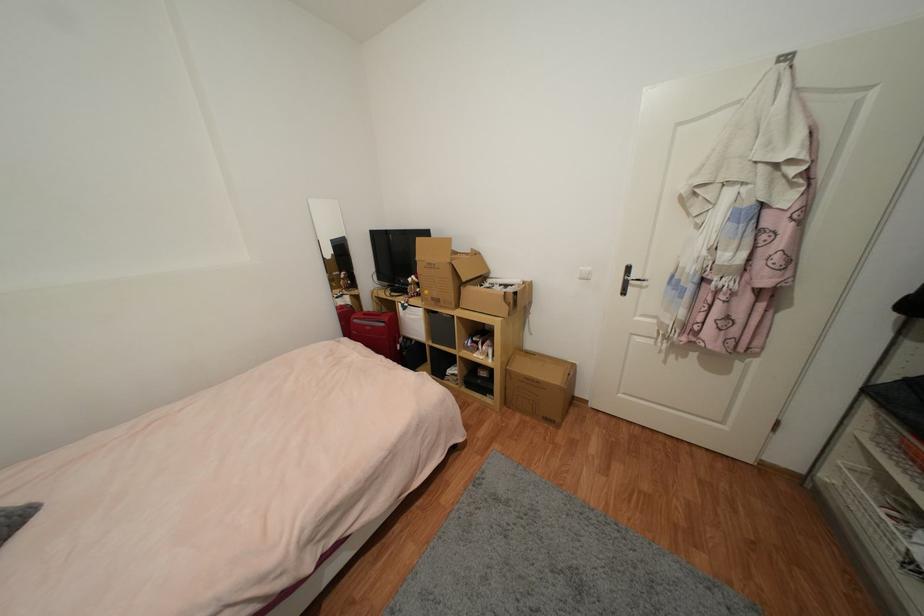
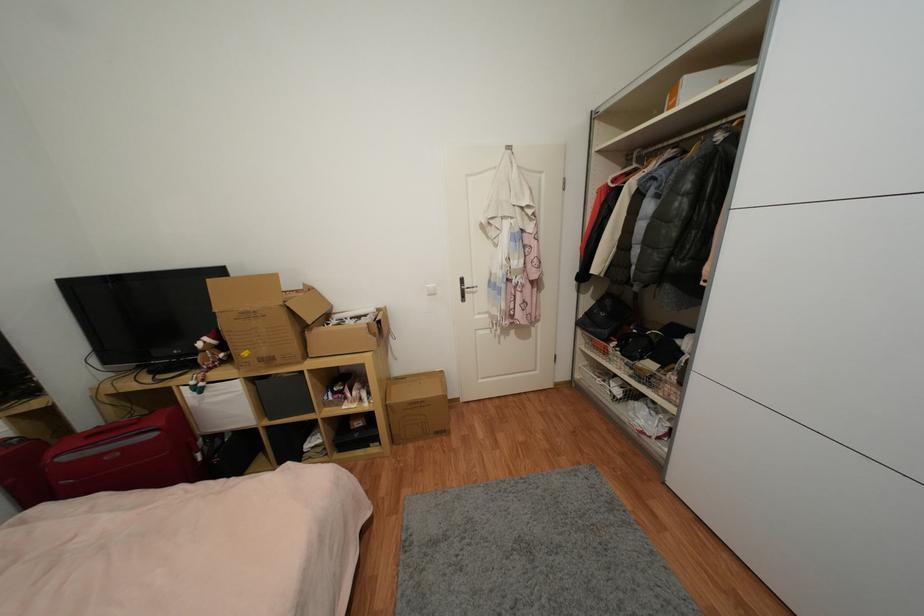
In the second image, find the point that corresponds to (x=409, y=306) in the first image.

(205, 386)